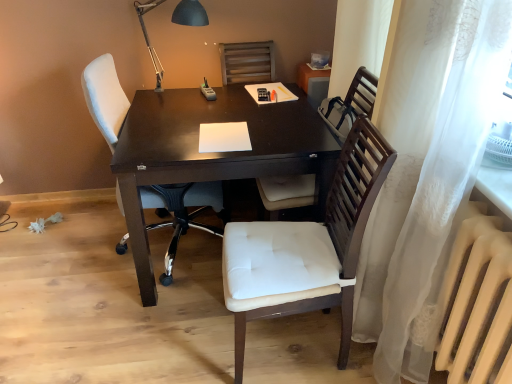
I want to click on vacant space in front of white fabric chair at left, which is counted as the first chair, starting from the left, so click(x=124, y=334).